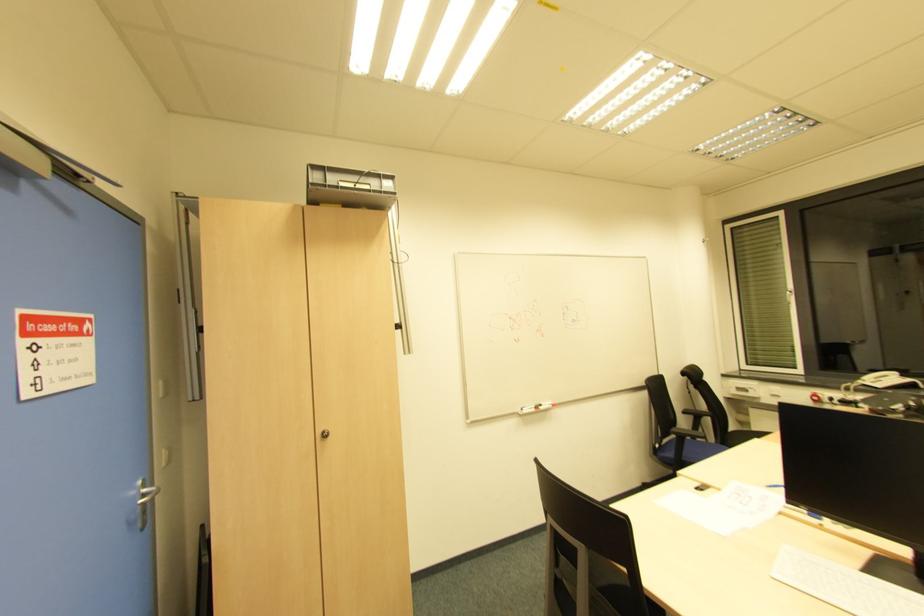
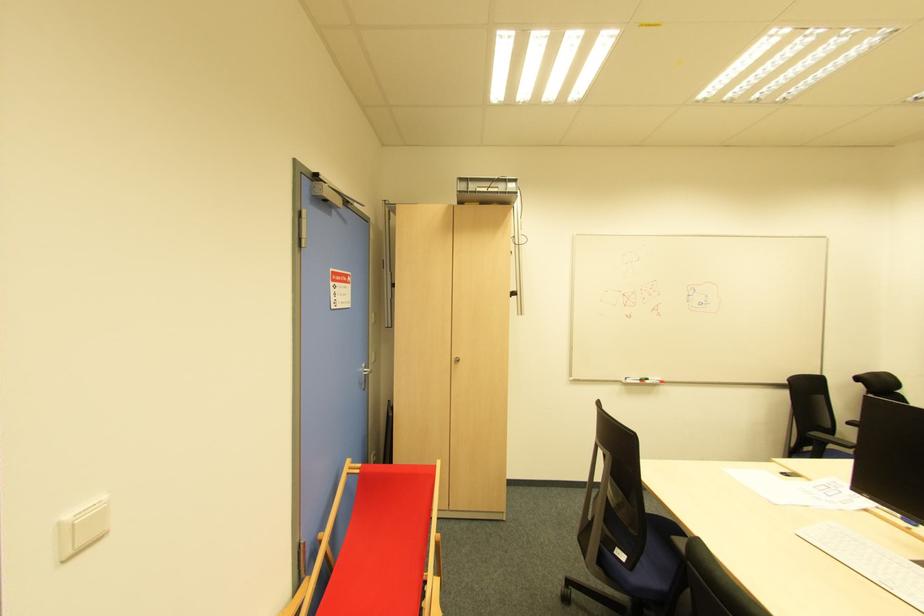
Locate, in the second image, the point that corresponds to point (541, 408) in the first image.

(647, 383)